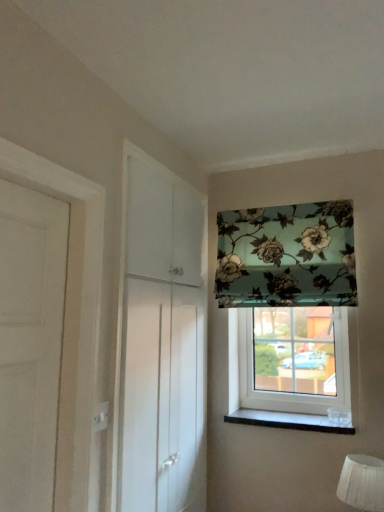
Question: Does white fabric lampshade at lower right turn towards transparent glass window at center, arranged as the first window when ordered from the bottom?

Choices:
 (A) no
 (B) yes

Answer: (A)

Question: From the image's perspective, is white fabric lampshade at lower right on transparent glass window at center, which is counted as the second window, starting from the top?

Choices:
 (A) no
 (B) yes

Answer: (A)

Question: Considering the relative sizes of white fabric lampshade at lower right and transparent glass window at center, arranged as the first window when ordered from the bottom, in the image provided, is white fabric lampshade at lower right wider than transparent glass window at center, arranged as the first window when ordered from the bottom,?

Choices:
 (A) yes
 (B) no

Answer: (A)

Question: Can you confirm if white fabric lampshade at lower right is positioned to the right of transparent glass window at center, which is counted as the second window, starting from the top?

Choices:
 (A) no
 (B) yes

Answer: (B)

Question: Is white fabric lampshade at lower right smaller than transparent glass window at center, which is counted as the second window, starting from the top?

Choices:
 (A) yes
 (B) no

Answer: (A)

Question: Is white fabric lampshade at lower right in contact with transparent glass window at center, which is counted as the second window, starting from the top?

Choices:
 (A) no
 (B) yes

Answer: (A)

Question: Can you confirm if transparent glass window at center, arranged as the first window when ordered from the bottom, is positioned to the right of white fabric lampshade at lower right?

Choices:
 (A) yes
 (B) no

Answer: (B)

Question: Considering the relative sizes of transparent glass window at center, arranged as the first window when ordered from the bottom, and white fabric lampshade at lower right in the image provided, is transparent glass window at center, arranged as the first window when ordered from the bottom, smaller than white fabric lampshade at lower right?

Choices:
 (A) yes
 (B) no

Answer: (B)

Question: From a real-world perspective, is transparent glass window at center, which is counted as the second window, starting from the top, over white fabric lampshade at lower right?

Choices:
 (A) no
 (B) yes

Answer: (B)

Question: Is transparent glass window at center, which is counted as the second window, starting from the top, not close to white fabric lampshade at lower right?

Choices:
 (A) no
 (B) yes

Answer: (A)

Question: Does transparent glass window at center, arranged as the first window when ordered from the bottom, have a larger size compared to white fabric lampshade at lower right?

Choices:
 (A) no
 (B) yes

Answer: (B)

Question: Can we say transparent glass window at center, which is counted as the second window, starting from the top, lies outside white fabric lampshade at lower right?

Choices:
 (A) yes
 (B) no

Answer: (A)

Question: Would you say white fabric lampshade at lower right contains white glossy cabinet at left?

Choices:
 (A) yes
 (B) no

Answer: (B)